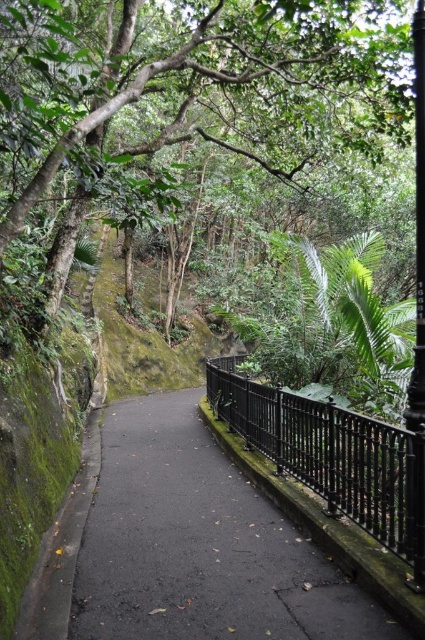
Question: Among these objects, which one is nearest to the camera?

Choices:
 (A) green leafy tree at center
 (B) black asphalt pavement at center
 (C) black wrought iron fence at center

Answer: (B)

Question: Can you confirm if black asphalt pavement at center is thinner than black wrought iron fence at center?

Choices:
 (A) no
 (B) yes

Answer: (A)

Question: Based on their relative distances, which object is farther from the green leafy tree at center?

Choices:
 (A) black wrought iron fence at center
 (B) black asphalt pavement at center

Answer: (A)

Question: Considering the relative positions of black asphalt pavement at center and green leafy tree at center in the image provided, where is black asphalt pavement at center located with respect to green leafy tree at center?

Choices:
 (A) left
 (B) right

Answer: (A)

Question: Which point is farther to the camera?

Choices:
 (A) (0, 26)
 (B) (16, 632)
 (C) (408, 449)

Answer: (A)

Question: Does black asphalt pavement at center appear under black wrought iron fence at center?

Choices:
 (A) no
 (B) yes

Answer: (B)